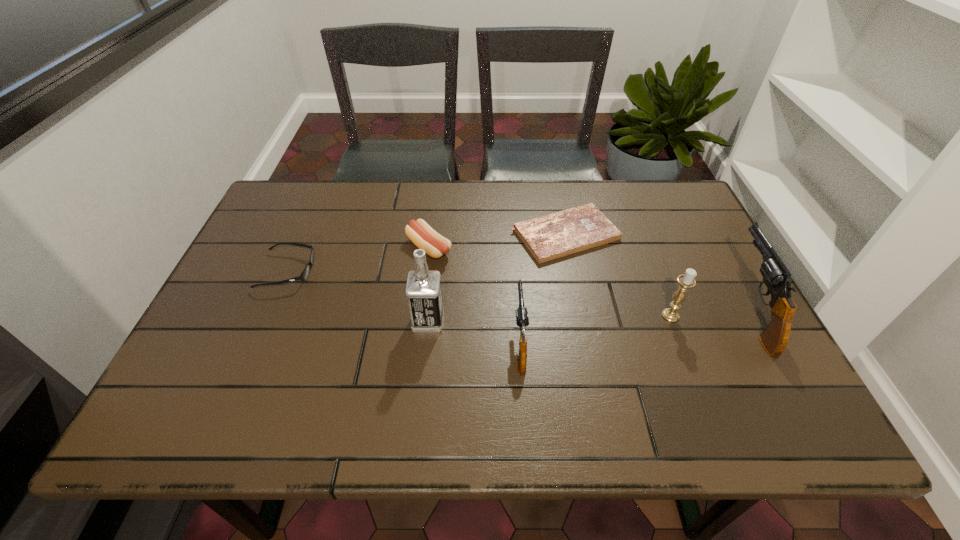
Where is `vacant position located 0.350m along the barrel of the left gun`? The image size is (960, 540). vacant position located 0.350m along the barrel of the left gun is located at coordinates (511, 220).

Locate an element on the screen. This screenshot has height=540, width=960. vacant region located 0.310m along the barrel of the left gun is located at coordinates (511, 228).

I want to click on free region located 0.290m along the barrel of the left gun, so click(x=512, y=233).

The height and width of the screenshot is (540, 960). What are the coordinates of `free space located 0.190m along the barrel of the rightmost object` in the screenshot? It's located at (703, 225).

Identify the location of vacant position located along the barrel of the rightmost object. The width and height of the screenshot is (960, 540). (704, 227).

I want to click on free location located 0.310m along the barrel of the rightmost object, so click(689, 201).

You are a GUI agent. You are given a task and a screenshot of the screen. Output one action in this format:
    pyautogui.click(x=<x>, y=<y>)
    Task: Click on the vacant area situated on the front of the shortest object
    
    Given the screenshot: What is the action you would take?
    pyautogui.click(x=574, y=278)

Locate an element on the screen. blank space located 0.280m on the front-facing side of the sunglasses is located at coordinates (420, 271).

This screenshot has height=540, width=960. Find the location of `vacant space situated on the front of the sausage`. vacant space situated on the front of the sausage is located at coordinates (412, 389).

This screenshot has width=960, height=540. In order to click on free space located on the front label of the vodka in this screenshot , I will do `click(486, 321)`.